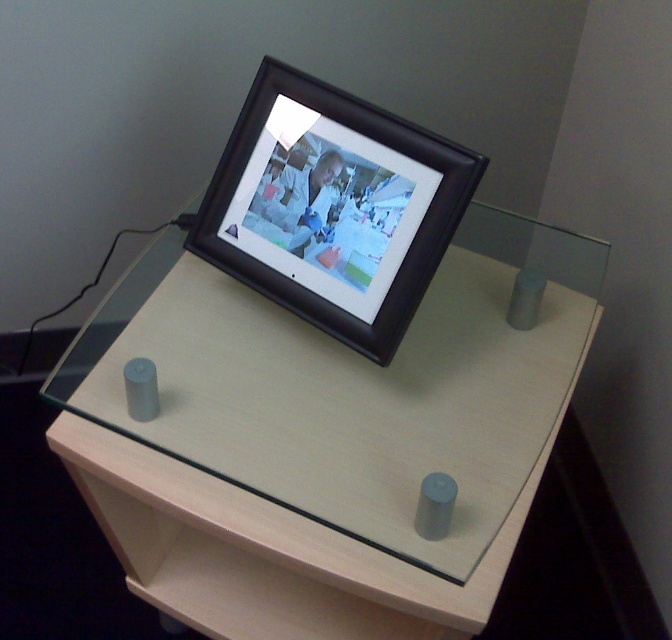
Does light wood computer desk at center appear on the left side of black matte picture frame at center?

Correct, you'll find light wood computer desk at center to the left of black matte picture frame at center.

Who is positioned more to the right, light wood computer desk at center or black matte picture frame at center?

Positioned to the right is black matte picture frame at center.

Identify the location of light wood computer desk at center. (325, 438).

You are a GUI agent. You are given a task and a screenshot of the screen. Output one action in this format:
    pyautogui.click(x=<x>, y=<y>)
    Task: Click on the light wood computer desk at center
    
    Given the screenshot: What is the action you would take?
    pyautogui.click(x=325, y=438)